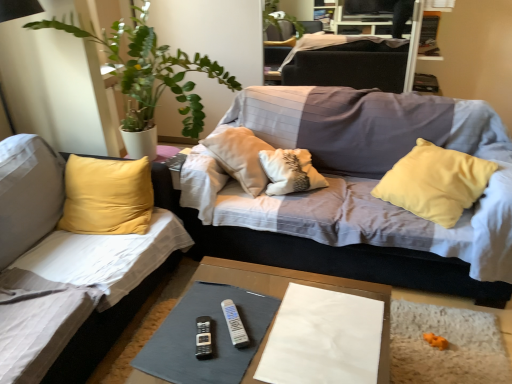
Where is `vacant space that is to the left of white plastic remote at center, which is the 1th remote from right to left`? vacant space that is to the left of white plastic remote at center, which is the 1th remote from right to left is located at coordinates [x=190, y=329].